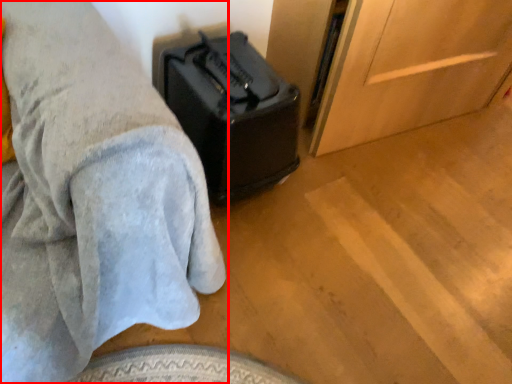
Question: From the image's perspective, what is the correct spatial positioning of furniture (annotated by the red box) in reference to luggage?

Choices:
 (A) below
 (B) above

Answer: (A)